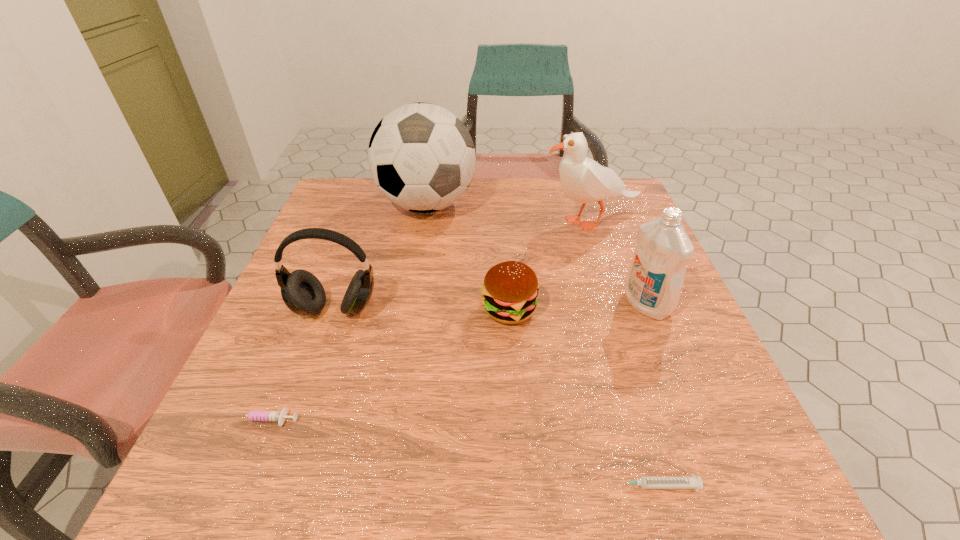
You are a GUI agent. You are given a task and a screenshot of the screen. Output one action in this format:
    pyautogui.click(x=<x>, y=<y>)
    Task: Click on the object at the far left corner
    This screenshot has height=540, width=960.
    Given the screenshot: What is the action you would take?
    pyautogui.click(x=421, y=157)

The image size is (960, 540). I want to click on object present at the far right corner, so click(x=583, y=180).

This screenshot has width=960, height=540. Find the location of `object at the near right corner`. object at the near right corner is located at coordinates (692, 482).

At what (x,y) coordinates should I click in order to perform the action: click on vacant space at the far edge. Please return your answer as a coordinate pair (x, y). Looking at the image, I should click on click(561, 200).

Identify the location of vacant space at the near edge of the desktop. (319, 496).

In the image, there is a desktop. Where is `free space at the left edge`? The width and height of the screenshot is (960, 540). free space at the left edge is located at coordinates (228, 422).

Find the location of a particular element. The width and height of the screenshot is (960, 540). free space at the right edge of the desktop is located at coordinates (681, 444).

The image size is (960, 540). What are the coordinates of `vacant space at the far left corner of the desktop` in the screenshot? It's located at (349, 205).

Identify the location of vacant space at the near right corner of the desktop. Image resolution: width=960 pixels, height=540 pixels. (771, 503).

Where is `vacant space in between the headset and the right syringe`? Image resolution: width=960 pixels, height=540 pixels. vacant space in between the headset and the right syringe is located at coordinates (494, 397).